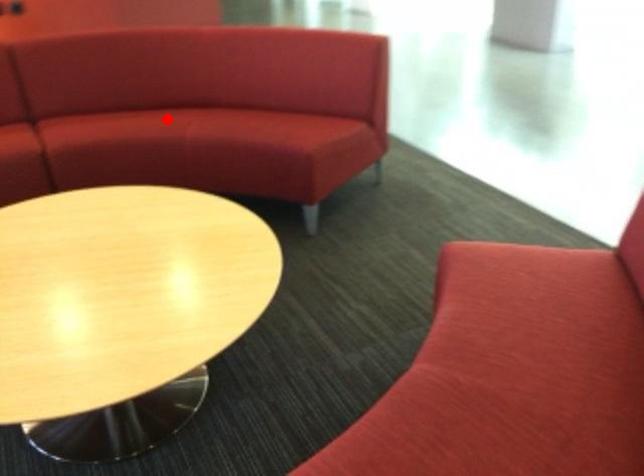
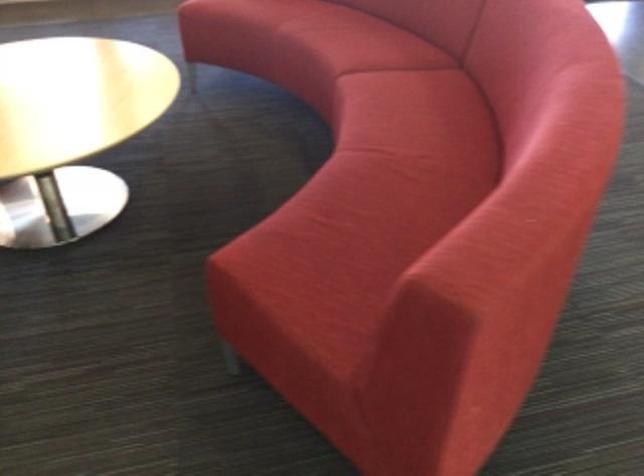
The point at the highlighted location is marked in the first image. Where is the corresponding point in the second image?

(422, 135)